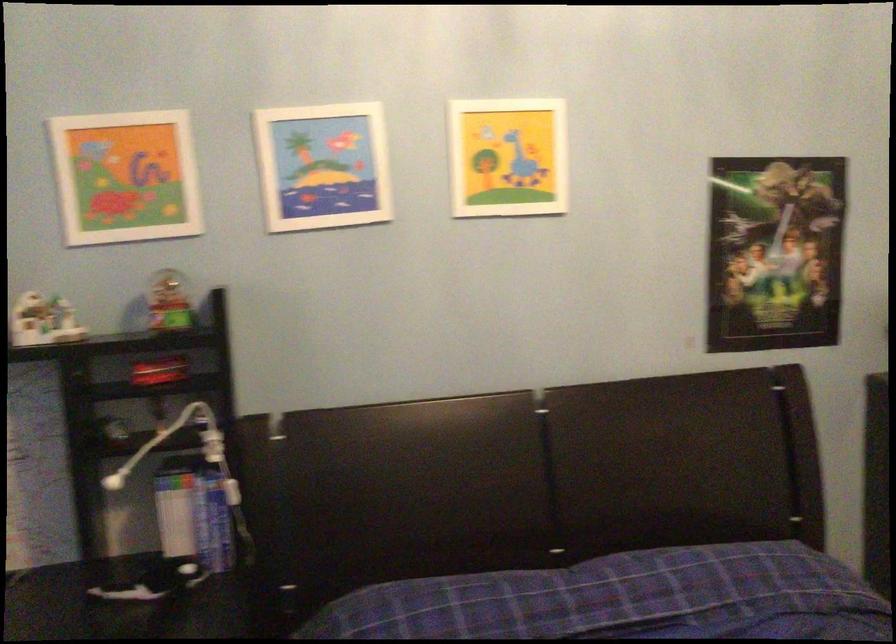
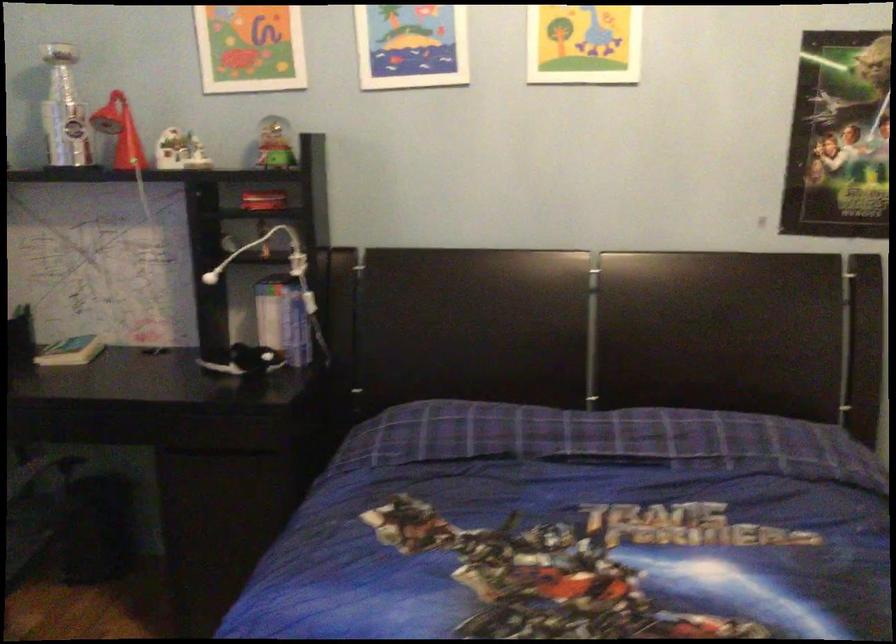
What movement of the cameraman would produce the second image?

The movement direction of the cameraman is right, backward.